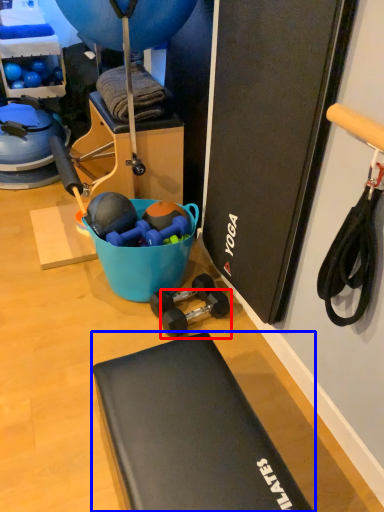
Question: Which of the following is the farthest to the observer, dumbbell (highlighted by a red box) or furniture (highlighted by a blue box)?

Choices:
 (A) dumbbell
 (B) furniture

Answer: (A)